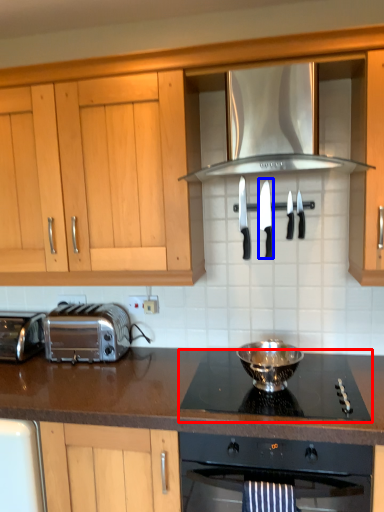
Question: Which object appears farthest to the camera in this image, gas stove (highlighted by a red box) or knife (highlighted by a blue box)?

Choices:
 (A) gas stove
 (B) knife

Answer: (B)